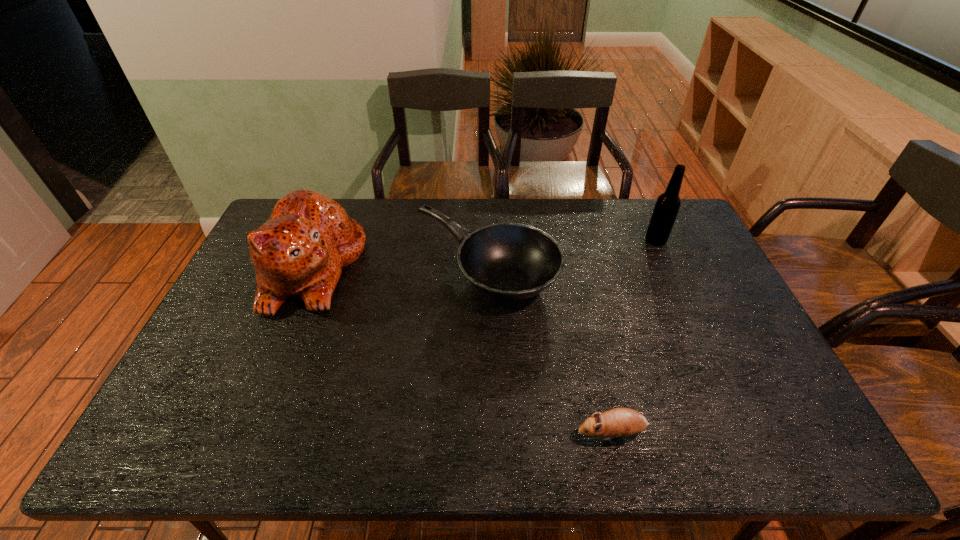
Identify the location of vacant space located 0.060m at the face of the nearest object. (549, 433).

You are a GUI agent. You are given a task and a screenshot of the screen. Output one action in this format:
    pyautogui.click(x=<x>, y=<y>)
    Task: Click on the cat present at the far edge
    The height and width of the screenshot is (540, 960).
    Given the screenshot: What is the action you would take?
    pyautogui.click(x=300, y=251)

Locate an element on the screen. This screenshot has width=960, height=540. beer bottle that is at the far edge is located at coordinates (667, 205).

At what (x,y) coordinates should I click in order to perform the action: click on frying pan at the far edge. Please return your answer as a coordinate pair (x, y). The height and width of the screenshot is (540, 960). Looking at the image, I should click on (507, 261).

This screenshot has height=540, width=960. In order to click on object present at the near edge in this screenshot , I will do `click(619, 422)`.

Where is `object that is at the left edge`? The height and width of the screenshot is (540, 960). object that is at the left edge is located at coordinates (300, 251).

At what (x,y) coordinates should I click in order to perform the action: click on object that is at the right edge. Please return your answer as a coordinate pair (x, y). This screenshot has height=540, width=960. Looking at the image, I should click on (667, 205).

Find the location of `object present at the far left corner`. object present at the far left corner is located at coordinates (300, 251).

Identify the location of object present at the far right corner. The width and height of the screenshot is (960, 540). (667, 205).

In the image, there is a desktop. Where is `blank space at the far edge`? This screenshot has height=540, width=960. blank space at the far edge is located at coordinates (505, 208).